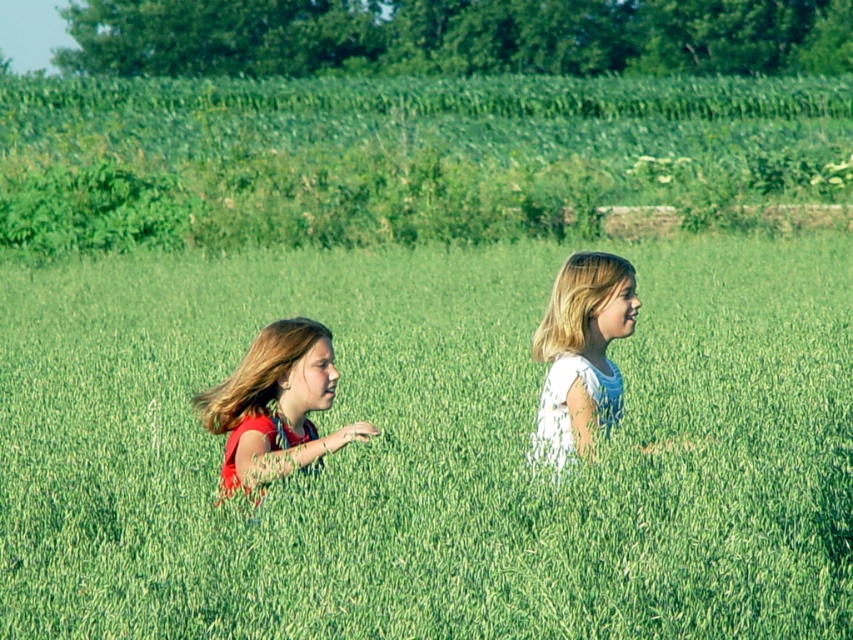
Question: Which of the following is the farthest from the observer?

Choices:
 (A) green grass at center
 (B) white lace dress at center
 (C) matte red shirt at left

Answer: (B)

Question: Can you confirm if green grass at center is positioned to the right of matte red shirt at left?

Choices:
 (A) no
 (B) yes

Answer: (A)

Question: Which point is closer to the camera taking this photo?

Choices:
 (A) [621, 259]
 (B) [62, 621]
 (C) [316, 332]

Answer: (B)

Question: Is matte red shirt at left smaller than white lace dress at center?

Choices:
 (A) yes
 (B) no

Answer: (B)

Question: Is green grass at center in front of white lace dress at center?

Choices:
 (A) yes
 (B) no

Answer: (A)

Question: Which point is farther to the camera?

Choices:
 (A) green grass at center
 (B) matte red shirt at left
 (C) white lace dress at center

Answer: (C)